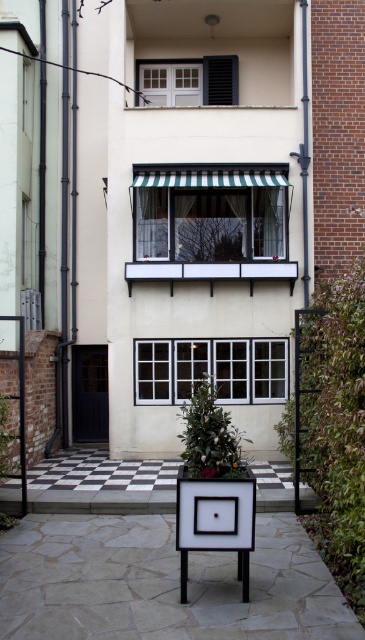
Question: Does white painted wood shed at center appear on the right side of green striped awning at center?

Choices:
 (A) no
 (B) yes

Answer: (B)

Question: Does white painted wood shed at center appear over green striped awning at center?

Choices:
 (A) yes
 (B) no

Answer: (B)

Question: Which object appears closest to the camera in this image?

Choices:
 (A) white painted wood shed at center
 (B) green striped awning at center

Answer: (B)

Question: Which object is closer to the camera taking this photo?

Choices:
 (A) green striped awning at center
 (B) white painted wood shed at center

Answer: (A)

Question: Is white painted wood shed at center to the left of green striped awning at center from the viewer's perspective?

Choices:
 (A) yes
 (B) no

Answer: (B)

Question: Which point is closer to the camera?

Choices:
 (A) white painted wood shed at center
 (B) green striped awning at center

Answer: (B)